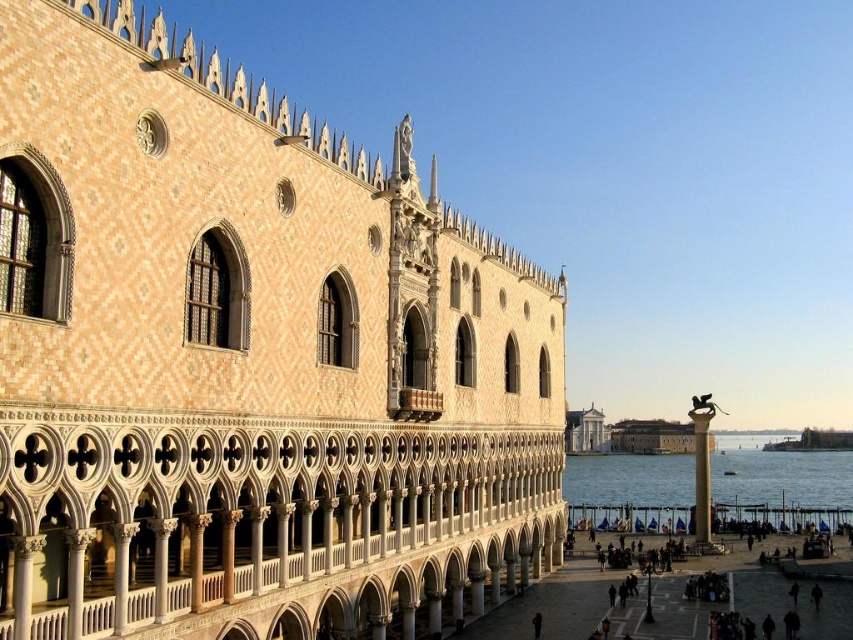
Question: Which object is the farthest from the clear blue water at lower right?

Choices:
 (A) bronze statue at center
 (B) beige mosaic palace at left

Answer: (B)

Question: Is beige mosaic palace at left closer to the viewer compared to clear blue water at lower right?

Choices:
 (A) no
 (B) yes

Answer: (B)

Question: Which point is closer to the camera?

Choices:
 (A) beige mosaic palace at left
 (B) bronze statue at center
 (C) clear blue water at lower right

Answer: (A)

Question: From the image, what is the correct spatial relationship of clear blue water at lower right in relation to bronze statue at center?

Choices:
 (A) left
 (B) right

Answer: (B)

Question: Which point is farther to the camera?

Choices:
 (A) clear blue water at lower right
 (B) beige mosaic palace at left

Answer: (A)

Question: Where is beige mosaic palace at left located in relation to bronze statue at center in the image?

Choices:
 (A) above
 (B) below

Answer: (A)